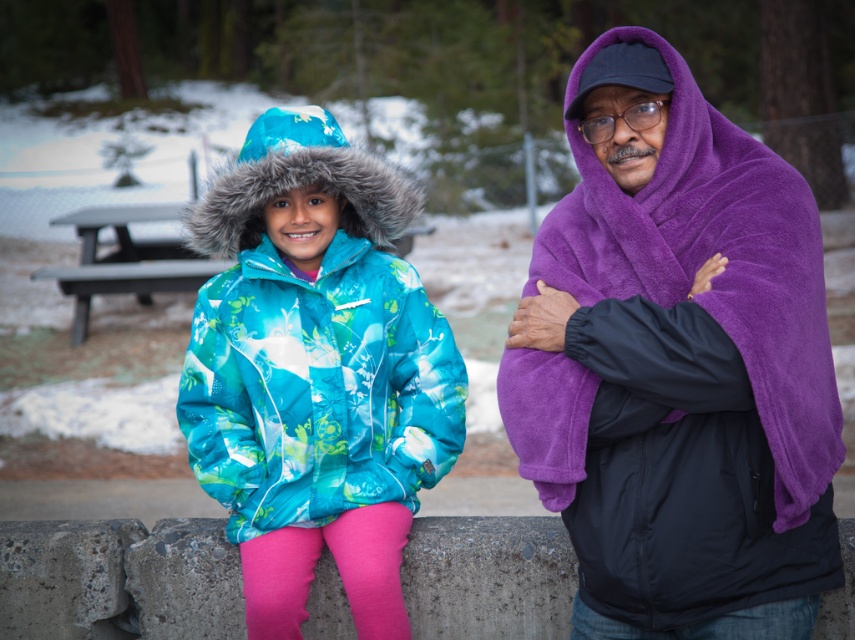
Question: Is purple fleece blanket at right below shiny blue jacket at center?

Choices:
 (A) no
 (B) yes

Answer: (A)

Question: Which point is farther to the camera?

Choices:
 (A) (369, 531)
 (B) (588, 406)
 (C) (71, 326)

Answer: (C)

Question: Can you confirm if shiny blue jacket at center is positioned to the left of gray wooden picnic table at center?

Choices:
 (A) no
 (B) yes

Answer: (A)

Question: Among these points, which one is nearest to the camera?

Choices:
 (A) (360, 378)
 (B) (105, 289)

Answer: (A)

Question: Is purple fleece blanket at right wider than shiny blue jacket at center?

Choices:
 (A) no
 (B) yes

Answer: (A)

Question: Which of these objects is positioned closest to the gray wooden picnic table at center?

Choices:
 (A) purple fleece blanket at right
 (B) shiny blue jacket at center

Answer: (B)